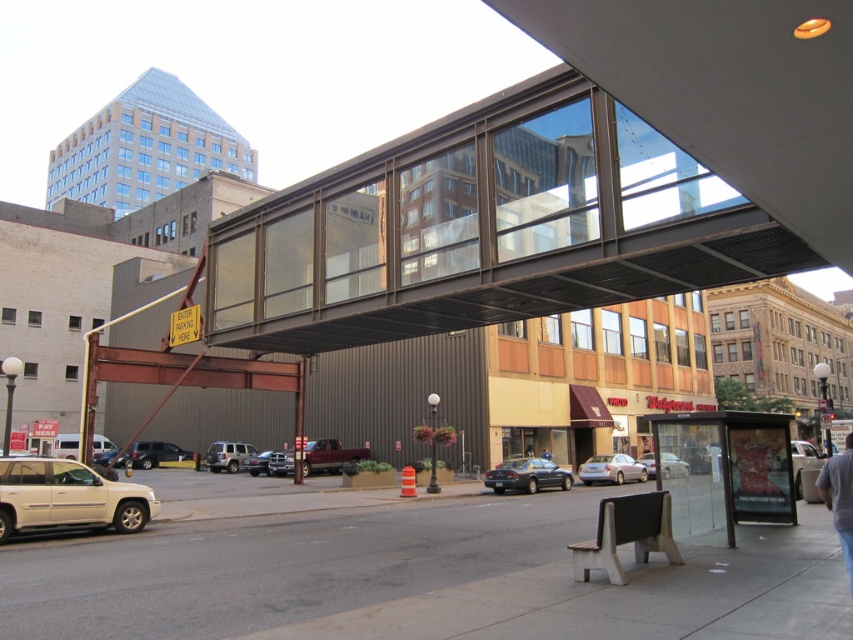
In the scene shown: Is gray cotton shirt at lower right smaller than metallic silver truck at center?

Incorrect, gray cotton shirt at lower right is not smaller in size than metallic silver truck at center.

What do you see at coordinates (839, 499) in the screenshot? I see `gray cotton shirt at lower right` at bounding box center [839, 499].

I want to click on gray cotton shirt at lower right, so click(x=839, y=499).

Which of these two, transparent glass bus stop at lower right or metallic silver truck at center, stands taller?

With more height is transparent glass bus stop at lower right.

Identify the location of transparent glass bus stop at lower right. The image size is (853, 640). [x=724, y=468].

You are a GUI agent. You are given a task and a screenshot of the screen. Output one action in this format:
    pyautogui.click(x=<x>, y=<y>)
    Task: Click on the transparent glass bus stop at lower right
    
    Given the screenshot: What is the action you would take?
    pyautogui.click(x=724, y=468)

Locate an element on the screen. transparent glass bus stop at lower right is located at coordinates (724, 468).

Who is taller, gray cotton shirt at lower right or satin silver sedan at center?

gray cotton shirt at lower right is taller.

Is gray cotton shirt at lower right taller than satin silver sedan at center?

Yes, gray cotton shirt at lower right is taller than satin silver sedan at center.

The image size is (853, 640). Identify the location of gray cotton shirt at lower right. (839, 499).